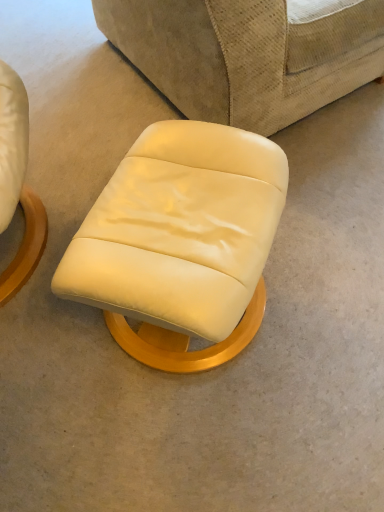
Question: Considering the relative sizes of beige fabric studio couch at center and matte cream leather ottoman at center in the image provided, is beige fabric studio couch at center thinner than matte cream leather ottoman at center?

Choices:
 (A) yes
 (B) no

Answer: (B)

Question: Is beige fabric studio couch at center beside matte cream leather ottoman at center?

Choices:
 (A) no
 (B) yes

Answer: (A)

Question: Are beige fabric studio couch at center and matte cream leather ottoman at center located far from each other?

Choices:
 (A) no
 (B) yes

Answer: (A)

Question: Is beige fabric studio couch at center positioned with its back to matte cream leather ottoman at center?

Choices:
 (A) yes
 (B) no

Answer: (B)

Question: From the image's perspective, is beige fabric studio couch at center on matte cream leather ottoman at center?

Choices:
 (A) yes
 (B) no

Answer: (A)

Question: Does beige fabric studio couch at center have a greater height compared to matte cream leather ottoman at center?

Choices:
 (A) yes
 (B) no

Answer: (A)

Question: Are matte cream leather ottoman at center and beige fabric studio couch at center far apart?

Choices:
 (A) no
 (B) yes

Answer: (A)

Question: Can you confirm if matte cream leather ottoman at center is bigger than beige fabric studio couch at center?

Choices:
 (A) yes
 (B) no

Answer: (B)

Question: Is matte cream leather ottoman at center shorter than beige fabric studio couch at center?

Choices:
 (A) no
 (B) yes

Answer: (B)

Question: Can you confirm if matte cream leather ottoman at center is positioned to the right of beige fabric studio couch at center?

Choices:
 (A) yes
 (B) no

Answer: (B)

Question: Considering the relative sizes of matte cream leather ottoman at center and beige fabric studio couch at center in the image provided, is matte cream leather ottoman at center thinner than beige fabric studio couch at center?

Choices:
 (A) no
 (B) yes

Answer: (B)

Question: From the image's perspective, is matte cream leather ottoman at center under beige fabric studio couch at center?

Choices:
 (A) no
 (B) yes

Answer: (B)

Question: Looking at their shapes, would you say beige fabric studio couch at center is wider or thinner than matte cream leather ottoman at center?

Choices:
 (A) thin
 (B) wide

Answer: (B)